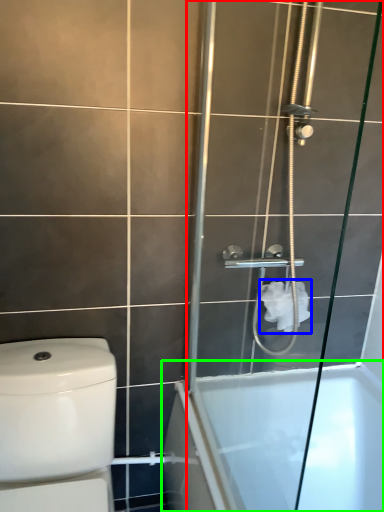
Question: Based on their relative distances, which object is nearer to screen door (highlighted by a red box)? Choose from toilet paper (highlighted by a blue box) and bathtub (highlighted by a green box).

Choices:
 (A) toilet paper
 (B) bathtub

Answer: (B)